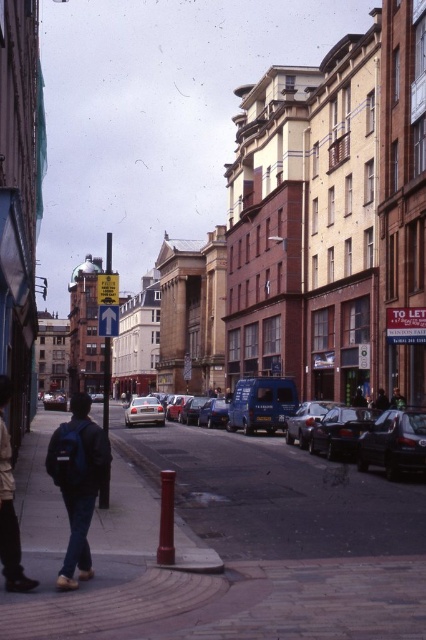
You are a delivery person trying to park your motorcycle between the brick pavement at lower center and the silver metallic car at center. Can your motorcycle fit in the space between them?

The brick pavement at lower center is wider than the silver metallic car at center, so the space between them may be sufficient for your motorcycle to fit. However, since the exact dimensions of the motorcycle are not provided, it is recommended to measure the space before attempting to park.

You are a delivery drone flying over the street scene. You need to drop a package at the exact location of the dark blue backpack at lower left. What are the coordinates where you should drop the package?

The coordinates for dropping the package should be at point (77, 483) where the dark blue backpack at lower left is located.